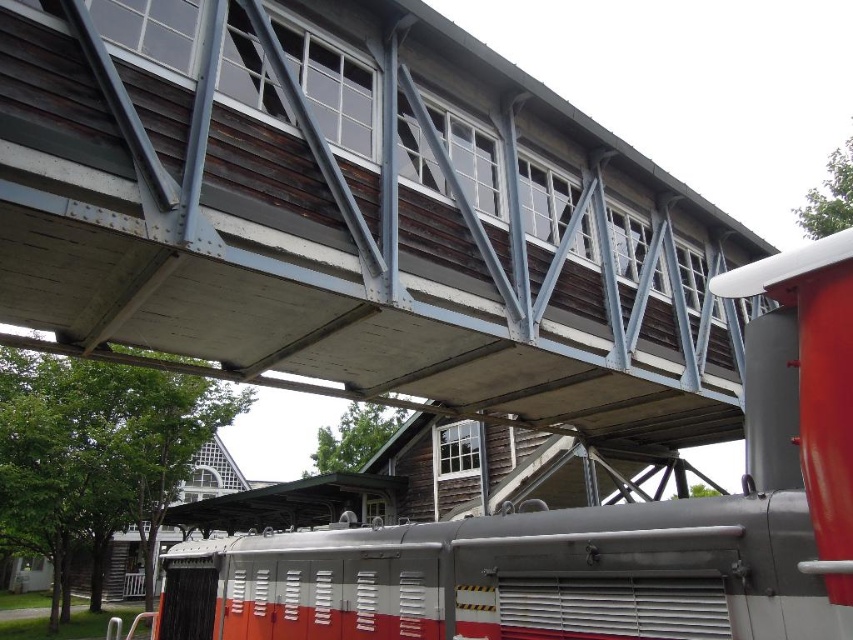
Who is shorter, wooden bridge at center or red and white metal train at center?

red and white metal train at center

Can you confirm if wooden bridge at center is wider than red and white metal train at center?

Yes.

Find the location of a particular element. The height and width of the screenshot is (640, 853). wooden bridge at center is located at coordinates (352, 212).

Where is `wooden bridge at center`? wooden bridge at center is located at coordinates (352, 212).